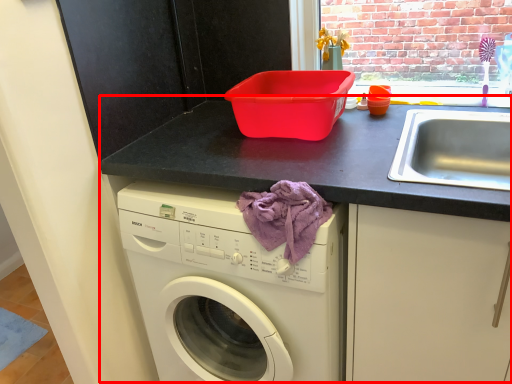
Question: In this image, where is counter (annotated by the red box) located relative to blanket?

Choices:
 (A) left
 (B) right

Answer: (A)